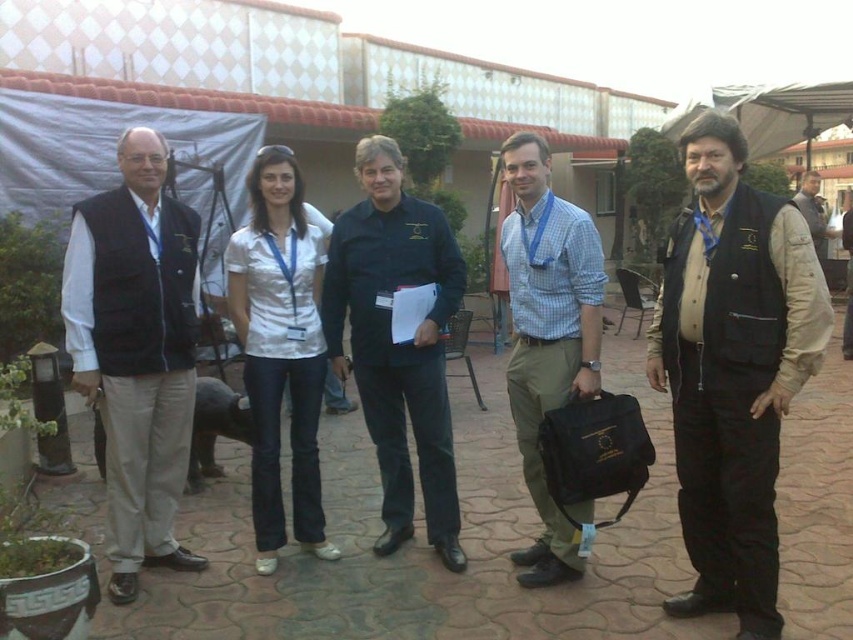
Question: Does blue checkered shirt at center have a larger size compared to brown leather jacket at center?

Choices:
 (A) no
 (B) yes

Answer: (A)

Question: Estimate the real-world distances between objects in this image. Which object is closer to the matte black vest at center?

Choices:
 (A) white glossy shirt at center
 (B) matte black vest at left
 (C) brown leather jacket at center

Answer: (A)

Question: Is matte black vest at center thinner than white glossy shirt at center?

Choices:
 (A) no
 (B) yes

Answer: (A)

Question: Which of the following is the closest to the observer?

Choices:
 (A) matte black vest at center
 (B) matte black vest at left
 (C) white glossy shirt at center
 (D) black shirt at center

Answer: (A)

Question: Does matte black vest at left appear on the right side of black shirt at center?

Choices:
 (A) no
 (B) yes

Answer: (A)

Question: Which object is closer to the camera taking this photo?

Choices:
 (A) matte black vest at center
 (B) matte black vest at left
 (C) black shirt at center
 (D) brown leather jacket at center

Answer: (A)